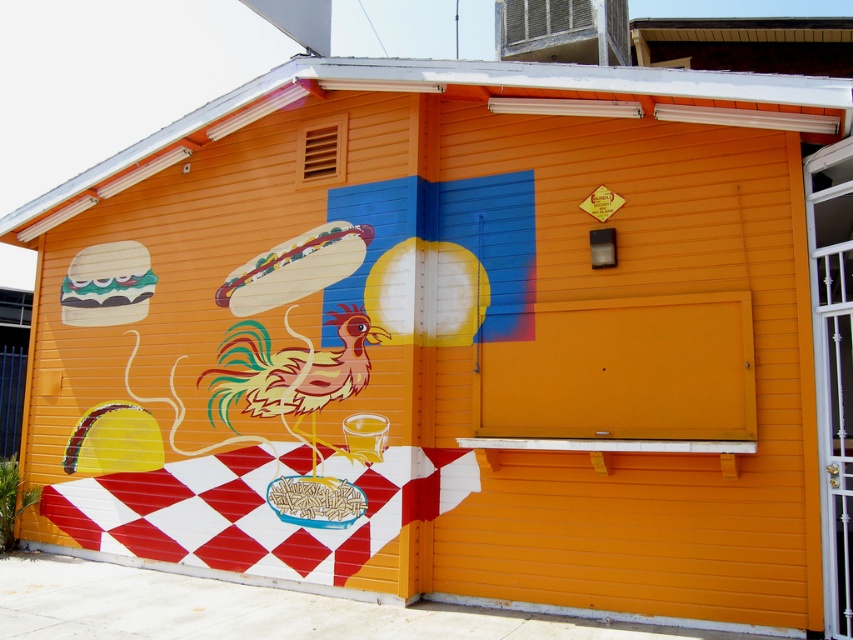
You are standing in front of the yellow building and see the orange matte garage door at center and the wooden hot dog at center. Which object is positioned to the right of the other?

The orange matte garage door at center is to the right of the wooden hot dog at center.

You are a painter who needs to place a new sticker on the orange matte garage door at center and the wooden hot dog at center. The sticker for the garage door is 1.2 meters tall, and the sticker for the hot dog is 0.3 meters tall. Considering their sizes, which object will have more vertical space left after placing the stickers?

The orange matte garage door at center is much taller than the wooden hot dog at center. Since the sticker for the garage door is 1.2 meters tall and the one for the hot dog is 0.3 meters tall, the orange matte garage door at center will have more vertical space remaining after placing the stickers because it is significantly taller than the wooden hot dog at center.